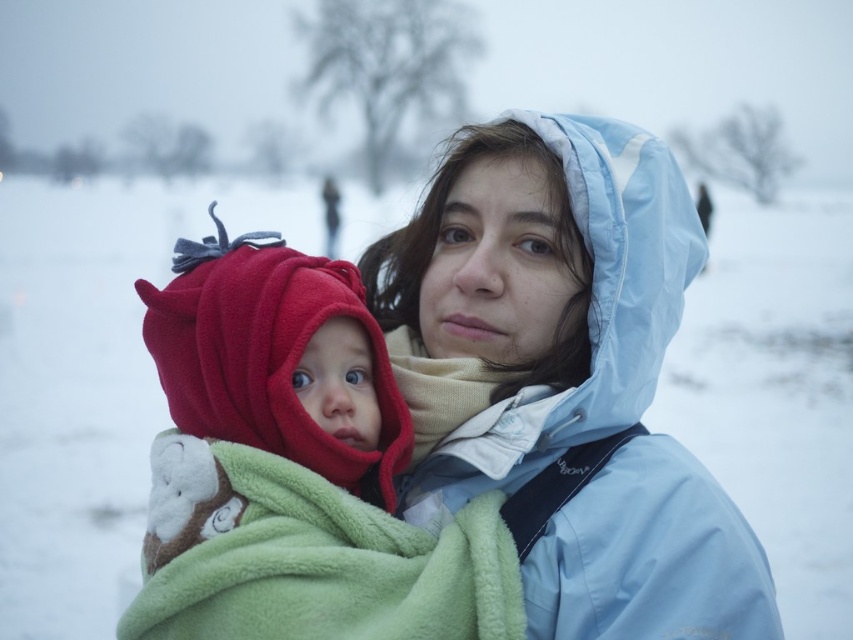
Question: Among these points, which one is farthest from the camera?

Choices:
 (A) (213, 627)
 (B) (416, 499)
 (C) (218, 410)
 (D) (204, 396)

Answer: (B)

Question: Does light blue waterproof jacket at center have a larger size compared to fuzzy fleece hat at left?

Choices:
 (A) yes
 (B) no

Answer: (A)

Question: Is white fluffy snow at center bigger than green fleece blanket at center?

Choices:
 (A) yes
 (B) no

Answer: (A)

Question: Is fuzzy red hood at center below fuzzy fleece hat at left?

Choices:
 (A) no
 (B) yes

Answer: (B)

Question: Which object is the farthest from the light blue waterproof jacket at center?

Choices:
 (A) fuzzy fleece hat at left
 (B) green fleece blanket at center
 (C) fuzzy red hood at center

Answer: (B)

Question: Which object is positioned closest to the white fluffy snow at center?

Choices:
 (A) light blue waterproof jacket at center
 (B) green fleece blanket at center
 (C) fuzzy fleece hat at left

Answer: (A)